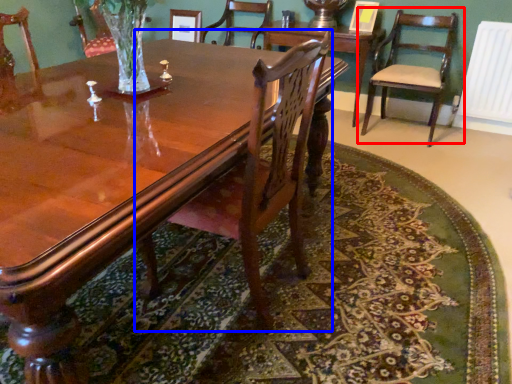
Question: Which object appears farthest to the camera in this image, chair (highlighted by a red box) or chair (highlighted by a blue box)?

Choices:
 (A) chair
 (B) chair

Answer: (A)